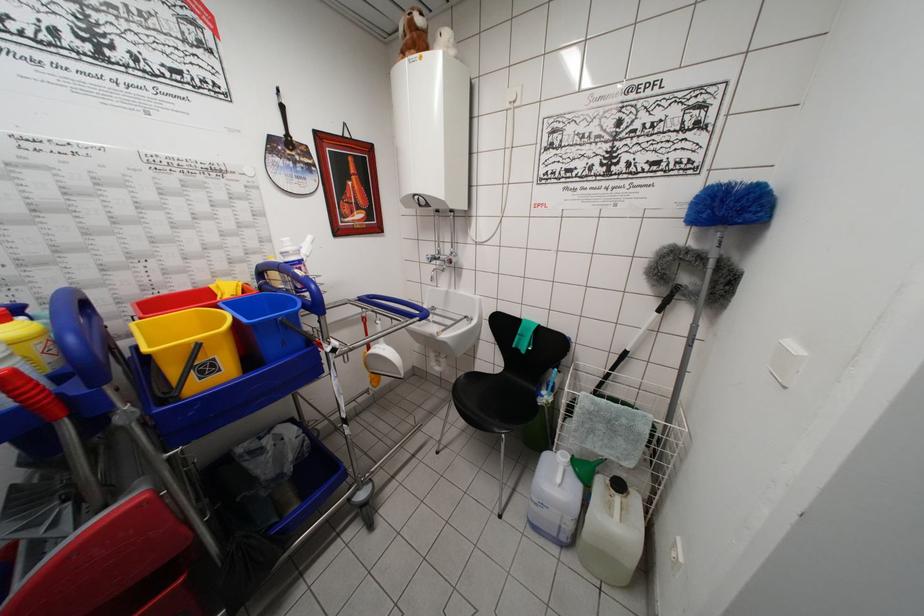
The width and height of the screenshot is (924, 616). Identify the location of yellow bucket handle. (174, 377).